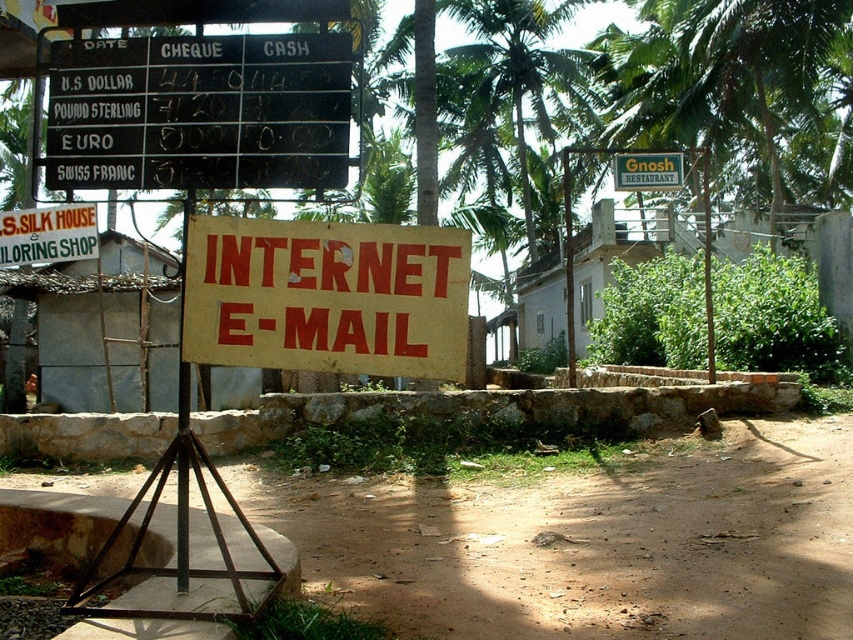
You are a traveler who wants to check the currency exchange rates displayed on the black plastic board at upper left and the yellow wood pole at center. Which object takes up more visual space in the scene?

The yellow wood pole at center takes up more visual space than the black plastic board at upper left because the black plastic board at upper left occupies less space than yellow wood pole at center.